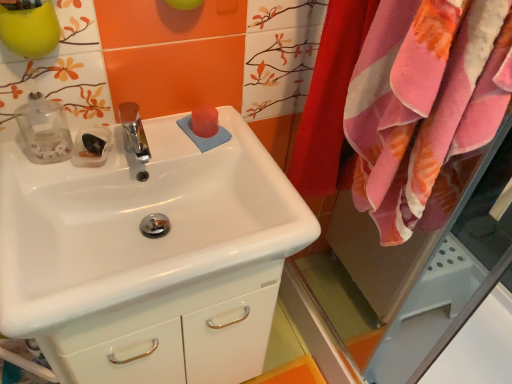
Describe the element at coordinates (329, 97) in the screenshot. I see `pink plush towel at right` at that location.

Describe the element at coordinates (425, 106) in the screenshot. I see `pink soft towel at right` at that location.

Locate an element on the screen. The height and width of the screenshot is (384, 512). white glossy sink at center is located at coordinates (138, 222).

Is pink soft towel at right positioned with its back to white glossy sink at center?

No, pink soft towel at right is not facing away from white glossy sink at center.

Is pink soft towel at right far from white glossy sink at center?

No, pink soft towel at right is not far from white glossy sink at center.

From a real-world perspective, is pink soft towel at right positioned above or below white glossy sink at center?

From a real-world perspective, pink soft towel at right is physically above white glossy sink at center.

I want to click on sink that is on the left side of pink soft towel at right, so click(138, 222).

Is white glossy sink at center thinner than pink soft towel at right?

No.

Is white glossy sink at center positioned beyond the bounds of pink soft towel at right?

Yes, white glossy sink at center is not within pink soft towel at right.

Are white glossy sink at center and pink soft towel at right beside each other?

white glossy sink at center and pink soft towel at right are clearly separated.

Is pink plush towel at right far from white glossy sink at center?

Actually, pink plush towel at right and white glossy sink at center are a little close together.

What's the angular difference between pink plush towel at right and white glossy sink at center's facing directions?

The facing directions of pink plush towel at right and white glossy sink at center are 0.454 degrees apart.

Do you think pink plush towel at right is within white glossy sink at center, or outside of it?

pink plush towel at right is spatially situated outside white glossy sink at center.

Where is `bath towel below the pink plush towel at right (from the image's perspective)`? This screenshot has width=512, height=384. bath towel below the pink plush towel at right (from the image's perspective) is located at coordinates click(x=425, y=106).

From a real-world perspective, is pink plush towel at right physically above pink soft towel at right?

No, from a real-world perspective, pink plush towel at right is not above pink soft towel at right.

Measure the distance from pink plush towel at right to pink soft towel at right.

pink plush towel at right and pink soft towel at right are 6.92 inches apart from each other.

Considering the positions of points (223, 185) and (346, 46), is point (223, 185) closer to camera compared to point (346, 46)?

No, (223, 185) is behind (346, 46).

Considering the sizes of white glossy sink at center and pink plush towel at right in the image, is white glossy sink at center wider or thinner than pink plush towel at right?

In the image, white glossy sink at center appears to be wider than pink plush towel at right.

Is white glossy sink at center at the right side of pink plush towel at right?

In fact, white glossy sink at center is to the left of pink plush towel at right.

From the image's perspective, would you say white glossy sink at center is positioned over pink plush towel at right?

No.

Considering the positions of objects pink soft towel at right and pink plush towel at right in the image provided, who is more to the left, pink soft towel at right or pink plush towel at right?

Positioned to the left is pink plush towel at right.

Is pink soft towel at right positioned with its back to pink plush towel at right?

Correct, pink soft towel at right is looking away from pink plush towel at right.

Between pink soft towel at right and pink plush towel at right, which one is positioned in front?

Positioned in front is pink soft towel at right.

Considering the relative sizes of pink soft towel at right and pink plush towel at right in the image provided, is pink soft towel at right smaller than pink plush towel at right?

Actually, pink soft towel at right might be larger than pink plush towel at right.

Image resolution: width=512 pixels, height=384 pixels. Identify the location of sink lying below the pink soft towel at right (from the image's perspective). (138, 222).

Locate an element on the screen. This screenshot has width=512, height=384. bath towel above the white glossy sink at center (from a real-world perspective) is located at coordinates (425, 106).

Looking at the image, which one is located closer to white glossy sink at center, pink soft towel at right or pink plush towel at right?

pink soft towel at right.

Based on their spatial positions, is white glossy sink at center or pink soft towel at right further from pink plush towel at right?

Based on the image, white glossy sink at center appears to be further to pink plush towel at right.

From the image, which object appears to be nearer to pink soft towel at right, pink plush towel at right or white glossy sink at center?

The object closer to pink soft towel at right is pink plush towel at right.

Consider the image. From the image, which object appears to be nearer to pink soft towel at right, white glossy sink at center or pink plush towel at right?

Based on the image, pink plush towel at right appears to be nearer to pink soft towel at right.

Estimate the real-world distances between objects in this image. Which object is further from white glossy sink at center, pink plush towel at right or pink soft towel at right?

The object further to white glossy sink at center is pink plush towel at right.

Which object lies nearer to the anchor point pink plush towel at right, pink soft towel at right or white glossy sink at center?

Among the two, pink soft towel at right is located nearer to pink plush towel at right.

At what (x,y) coordinates should I click in order to perform the action: click on curtain located between white glossy sink at center and pink soft towel at right in the left-right direction. Please return your answer as a coordinate pair (x, y). Looking at the image, I should click on (329, 97).